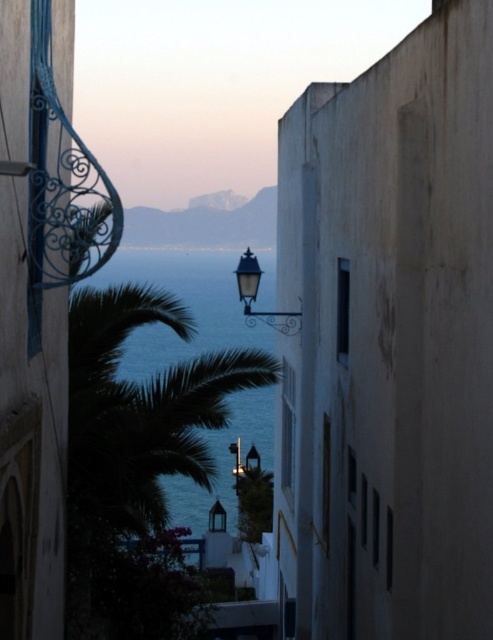
Question: Is blue water at center wider than polished brass streetlamp at center?

Choices:
 (A) no
 (B) yes

Answer: (B)

Question: Observing the image, what is the correct spatial positioning of blue water at center in reference to polished brass streetlamp at center?

Choices:
 (A) right
 (B) left

Answer: (B)

Question: Does blue water at center appear over polished brass streetlamp at center?

Choices:
 (A) no
 (B) yes

Answer: (A)

Question: Which point is closer to the camera taking this photo?

Choices:
 (A) (74, 410)
 (B) (292, 324)

Answer: (A)